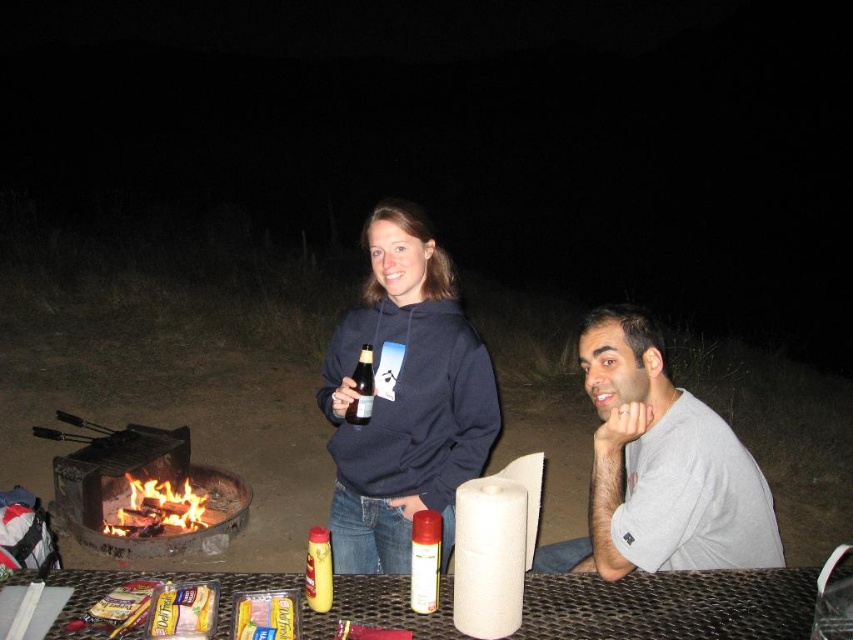
Question: Which of these objects is positioned farthest from the yellow plastic cheese at table center?

Choices:
 (A) satin gold spray can at center
 (B) metallic mesh table at lower center
 (C) dark blue hoodie at center
 (D) brick fire pit at lower left

Answer: (D)

Question: Among these objects, which one is nearest to the camera?

Choices:
 (A) yellow plastic cheese at table center
 (B) satin gold spray can at center

Answer: (A)

Question: Which point is farther to the camera?

Choices:
 (A) dark blue hoodie at center
 (B) brick fire pit at lower left

Answer: (B)

Question: Can you confirm if dark blue hoodie at center is positioned below gray cotton t-shirt at right?

Choices:
 (A) yes
 (B) no

Answer: (A)

Question: Can you confirm if yellow plastic bottle at center is wider than brown glass bottle at center?

Choices:
 (A) no
 (B) yes

Answer: (A)

Question: Does gray cotton t-shirt at right have a greater width compared to brown glass bottle at center?

Choices:
 (A) yes
 (B) no

Answer: (A)